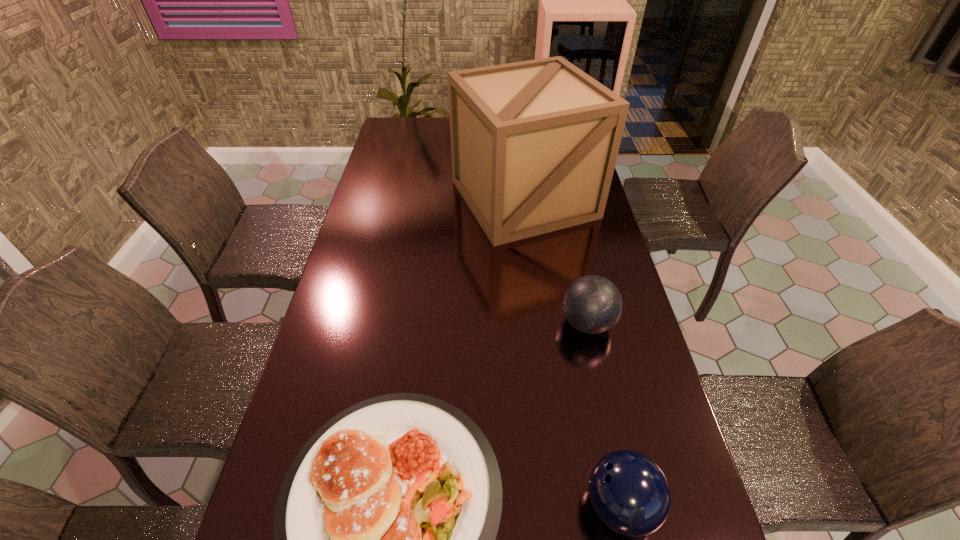
At what (x,y) coordinates should I click in order to perform the action: click on box. Please return your answer as a coordinate pair (x, y). Looking at the image, I should click on pos(534,144).

You are a GUI agent. You are given a task and a screenshot of the screen. Output one action in this format:
    pyautogui.click(x=<x>, y=<y>)
    Task: Click on the tallest object
    
    Given the screenshot: What is the action you would take?
    pyautogui.click(x=534, y=144)

Locate an element on the screen. The height and width of the screenshot is (540, 960). the second farthest object is located at coordinates (592, 304).

This screenshot has height=540, width=960. What are the coordinates of `vacant space located 0.150m on the front of the tallest object` in the screenshot? It's located at (534, 279).

This screenshot has height=540, width=960. In order to click on vacant space located 0.140m on the grip area of the second farthest object in this screenshot , I will do `click(509, 323)`.

The width and height of the screenshot is (960, 540). I want to click on vacant space located 0.370m on the grip area of the second farthest object, so click(426, 323).

At what (x,y) coordinates should I click in order to perform the action: click on free space located on the grip area of the second farthest object. Please return your answer as a coordinate pair (x, y). Image resolution: width=960 pixels, height=540 pixels. Looking at the image, I should click on (462, 323).

Where is `box that is positioned at the right edge`? Image resolution: width=960 pixels, height=540 pixels. box that is positioned at the right edge is located at coordinates (534, 144).

At what (x,y) coordinates should I click in order to perform the action: click on bowling ball that is positioned at the right edge. Please return your answer as a coordinate pair (x, y). The width and height of the screenshot is (960, 540). Looking at the image, I should click on click(592, 304).

Find the location of `vacant space at the far edge of the desktop`. vacant space at the far edge of the desktop is located at coordinates (426, 118).